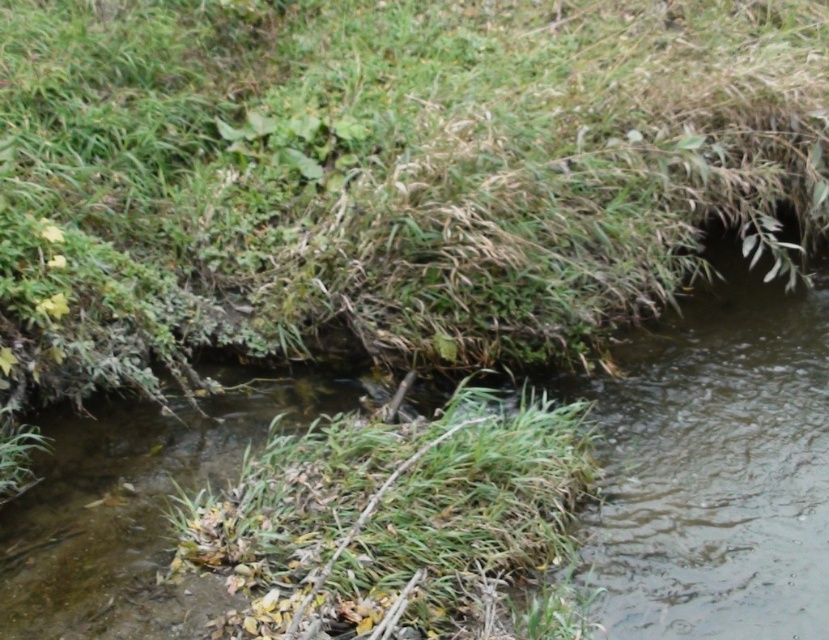
Can you confirm if clear water at center is taller than green grass at center?

Correct, clear water at center is much taller as green grass at center.

Does point (726, 385) come farther from viewer compared to point (427, 515)?

That is True.

Does point (764, 621) lie behind point (466, 445)?

No.

What are the coordinates of `clear water at center` in the screenshot? It's located at (715, 465).